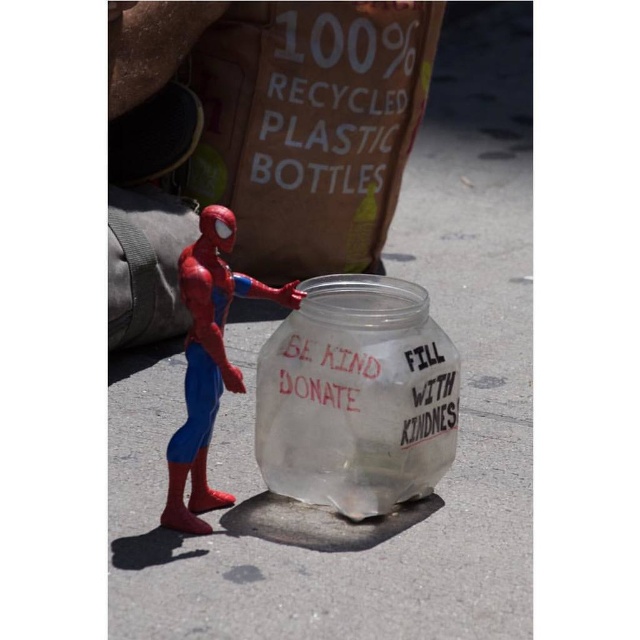
Between transparent plastic jar at center and shiny plastic spider-man at center, which one has more height?

Standing taller between the two is shiny plastic spider-man at center.

This screenshot has width=640, height=640. What do you see at coordinates (356, 396) in the screenshot?
I see `transparent plastic jar at center` at bounding box center [356, 396].

Who is more distant from viewer, (x=324, y=285) or (x=198, y=282)?

The point (x=324, y=285) is behind.

The width and height of the screenshot is (640, 640). I want to click on transparent plastic jar at center, so click(356, 396).